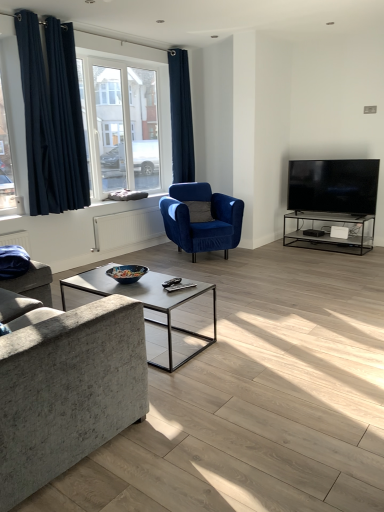
Question: Considering the relative sizes of clear glass window at upper left and textured gray fabric couch at left in the image provided, is clear glass window at upper left smaller than textured gray fabric couch at left?

Choices:
 (A) yes
 (B) no

Answer: (A)

Question: Would you say clear glass window at upper left contains textured gray fabric couch at left?

Choices:
 (A) yes
 (B) no

Answer: (B)

Question: From a real-world perspective, is clear glass window at upper left located higher than textured gray fabric couch at left?

Choices:
 (A) yes
 (B) no

Answer: (A)

Question: Are clear glass window at upper left and textured gray fabric couch at left located far from each other?

Choices:
 (A) yes
 (B) no

Answer: (A)

Question: Is clear glass window at upper left to the right of textured gray fabric couch at left from the viewer's perspective?

Choices:
 (A) yes
 (B) no

Answer: (A)

Question: Considering the positions of point (137, 121) and point (177, 179), is point (137, 121) closer or farther from the camera than point (177, 179)?

Choices:
 (A) farther
 (B) closer

Answer: (B)

Question: From a real-world perspective, relative to dark blue velvet curtain at upper center, positioned as the 1th curtain in back-to-front order, is clear glass window at upper left vertically above or below?

Choices:
 (A) above
 (B) below

Answer: (B)

Question: Looking at the image, does clear glass window at upper left seem bigger or smaller compared to dark blue velvet curtain at upper center, the 2th curtain viewed from the left?

Choices:
 (A) big
 (B) small

Answer: (A)

Question: Considering the positions of clear glass window at upper left and dark blue velvet curtain at upper center, the 2th curtain viewed from the left, in the image, is clear glass window at upper left taller or shorter than dark blue velvet curtain at upper center, the 2th curtain viewed from the left,?

Choices:
 (A) tall
 (B) short

Answer: (B)

Question: From the image's perspective, is clear glass window at upper left above or below velvet blue armchair at center?

Choices:
 (A) above
 (B) below

Answer: (A)

Question: From a real-world perspective, is clear glass window at upper left physically located above or below velvet blue armchair at center?

Choices:
 (A) above
 (B) below

Answer: (A)

Question: Is clear glass window at upper left in front of or behind velvet blue armchair at center in the image?

Choices:
 (A) front
 (B) behind

Answer: (B)

Question: Is point (147, 146) closer or farther from the camera than point (218, 202)?

Choices:
 (A) closer
 (B) farther

Answer: (B)

Question: From a real-world perspective, relative to textured gray fabric couch at left, is clear glass window at upper left vertically above or below?

Choices:
 (A) below
 (B) above

Answer: (B)

Question: Is point (104, 98) closer or farther from the camera than point (100, 377)?

Choices:
 (A) closer
 (B) farther

Answer: (B)